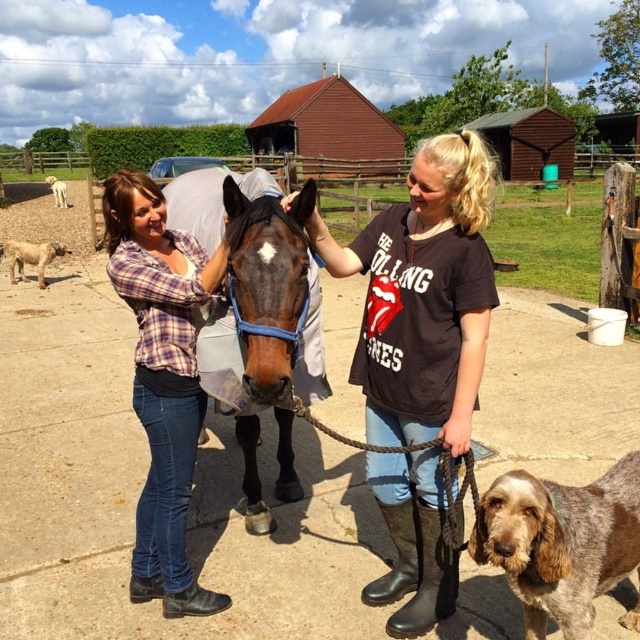
Measure the distance from speckled fur dog at lower right to white fluffy dog at upper left.

A distance of 74.43 feet exists between speckled fur dog at lower right and white fluffy dog at upper left.

Can you confirm if speckled fur dog at lower right is positioned to the right of white fluffy dog at upper left?

Yes, speckled fur dog at lower right is to the right of white fluffy dog at upper left.

Where is `speckled fur dog at lower right`? This screenshot has height=640, width=640. speckled fur dog at lower right is located at coordinates (561, 541).

Find the location of `speckled fur dog at lower right`. speckled fur dog at lower right is located at coordinates (561, 541).

Between brown matte shirt at center and brown glossy horse at center, which one is positioned higher?

brown glossy horse at center is above.

Between brown matte shirt at center and brown glossy horse at center, which one has less height?

brown glossy horse at center

Where is `brown matte shirt at center`? This screenshot has height=640, width=640. brown matte shirt at center is located at coordinates (422, 296).

Which is above, brown matte shirt at center or light brown fur at lower left?

light brown fur at lower left

Is brown matte shirt at center bigger than light brown fur at lower left?

Incorrect, brown matte shirt at center is not larger than light brown fur at lower left.

Between point (401, 595) and point (26, 276), which one is positioned in front?

Positioned in front is point (401, 595).

Find the location of a particular element. brown matte shirt at center is located at coordinates (x=422, y=296).